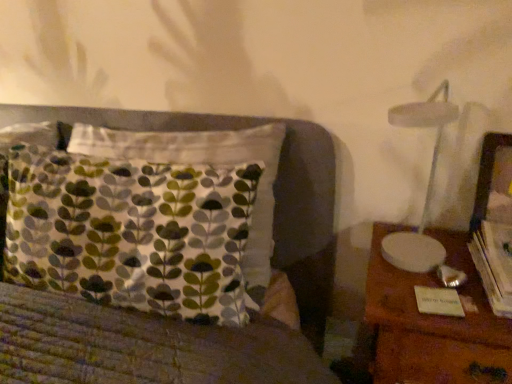
Question: Is wooden nightstand at right taller or shorter than wooden picture frame at right?

Choices:
 (A) tall
 (B) short

Answer: (A)

Question: From the image's perspective, is wooden nightstand at right positioned above or below wooden picture frame at right?

Choices:
 (A) below
 (B) above

Answer: (A)

Question: Which object is positioned closest to the wooden picture frame at right?

Choices:
 (A) wooden nightstand at right
 (B) hardcover book at right

Answer: (B)

Question: Considering the real-world distances, which object is closest to the hardcover book at right?

Choices:
 (A) wooden nightstand at right
 (B) wooden picture frame at right

Answer: (B)